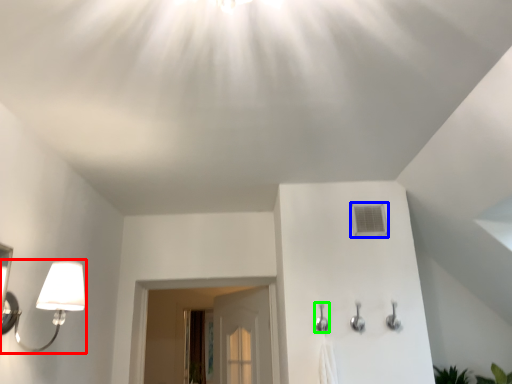
Question: Based on their relative distances, which object is nearer to lamp (highlighted by a red box)? Choose from air conditioner (highlighted by a blue box) and shower (highlighted by a green box).

Choices:
 (A) air conditioner
 (B) shower

Answer: (B)